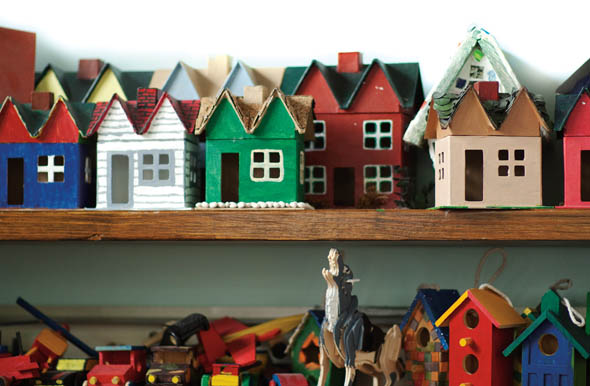
The height and width of the screenshot is (386, 590). Identify the location of shelf. (327, 224).